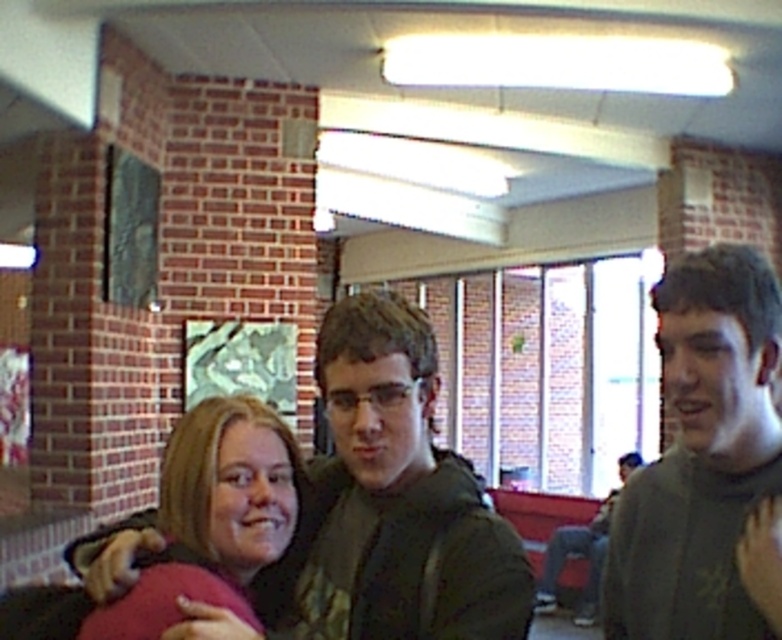
You are a photographer setting up for a group photo. You notice two jackets in the scene, the dark green hoodie at center and the dark gray jacket at right. Which jacket is positioned higher in the image?

The dark green hoodie at center is positioned higher than the dark gray jacket at right.

You are standing in the public space shown in the image. There is a point marked at coordinates (196,474). What object is located at that point?

The point at (196,474) is where the blonde hair at center is located.

You are standing in the room and see the point at coordinates [730,500]. If you want to reach that point without moving your feet, can you touch it with your outstretched hand?

The point at coordinates [730,500] is 4.49 feet from the viewer. Since the average arm length is about 2.5 feet, you cannot reach it without moving your feet.